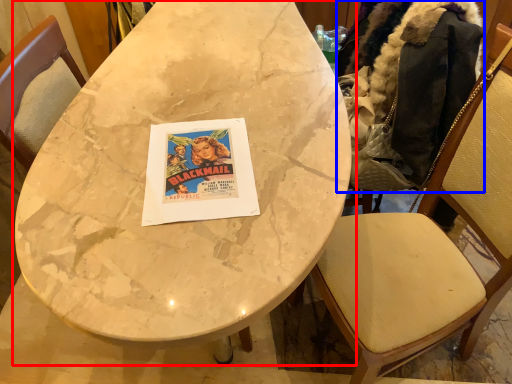
Question: Which object is further to the camera taking this photo, table (highlighted by a red box) or jacket (highlighted by a blue box)?

Choices:
 (A) table
 (B) jacket

Answer: (B)